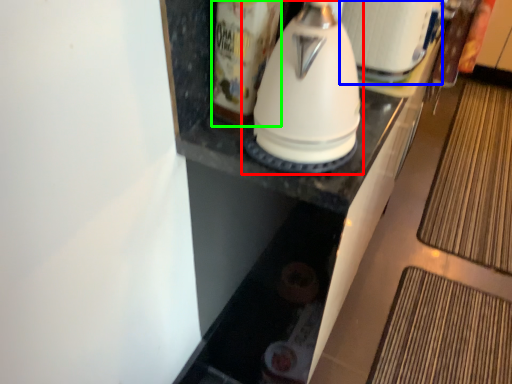
Question: Considering the real-world distances, which object is farthest from kitchen appliance (highlighted by a red box)? appliance (highlighted by a blue box) or beverage (highlighted by a green box)?

Choices:
 (A) appliance
 (B) beverage

Answer: (A)